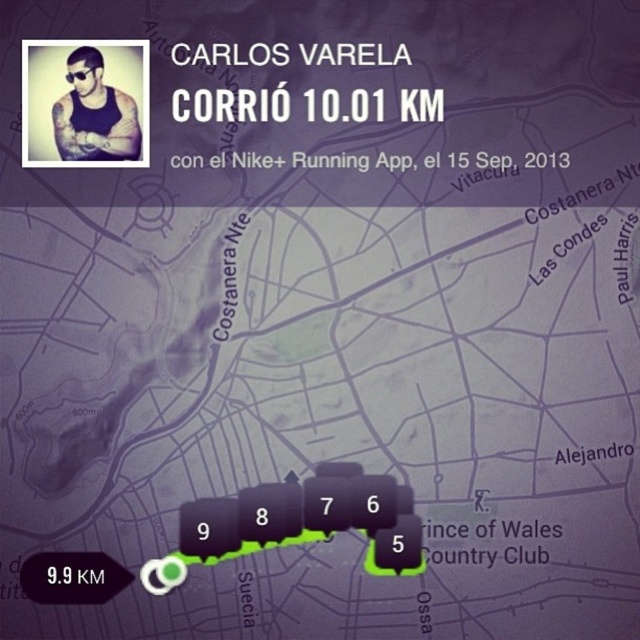
Does matte black tank top at upper left appear over black plastic goggles at upper left?

Actually, matte black tank top at upper left is below black plastic goggles at upper left.

Does matte black tank top at upper left have a lesser height compared to black plastic goggles at upper left?

No.

Locate an element on the screen. This screenshot has width=640, height=640. matte black tank top at upper left is located at coordinates (93, 113).

You are a GUI agent. You are given a task and a screenshot of the screen. Output one action in this format:
    pyautogui.click(x=<x>, y=<y>)
    Task: Click on the matte black tank top at upper left
    
    Given the screenshot: What is the action you would take?
    pyautogui.click(x=93, y=113)